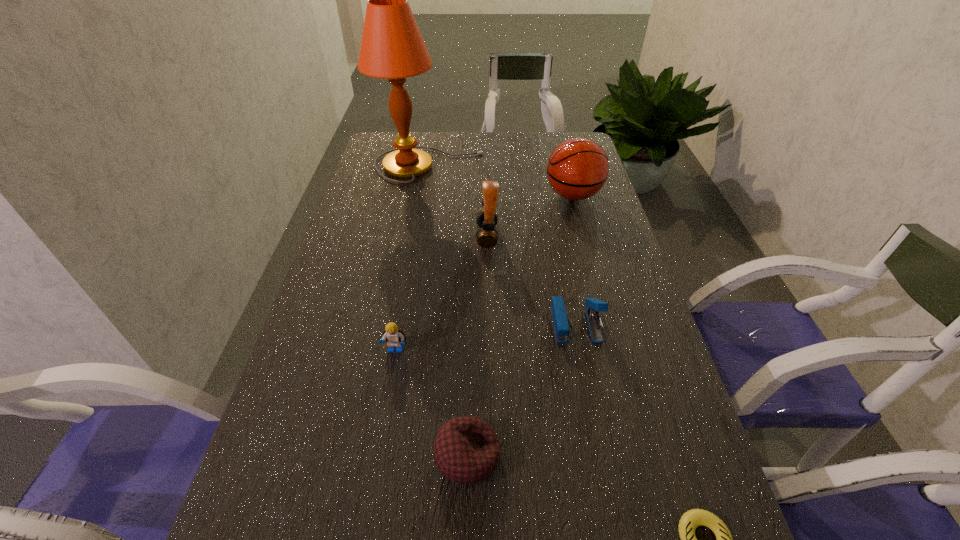
This screenshot has width=960, height=540. Find the location of `vacant region between the basketball and the Lego`. vacant region between the basketball and the Lego is located at coordinates (485, 273).

Identify which object is the nearest to the sixth farthest object. Please provide its 2D coordinates. Your answer should be formatted as a tuple, i.e. [(x, y)], where the tuple contains the x and y coordinates of a point satisfying the conditions above.

[(394, 337)]

The image size is (960, 540). What are the coordinates of `object that is the closest to the nearest object` in the screenshot? It's located at (466, 449).

Identify the location of vacant space that satisfies the following two spatial constraints: 1. on the ear cups of the headset; 2. on the back side of the stapler. The width and height of the screenshot is (960, 540). (489, 323).

Find the location of a particular element. vacant position in the image that satisfies the following two spatial constraints: 1. on the front side of the sixth farthest object; 2. on the left side of the lamp is located at coordinates (383, 456).

At what (x,y) coordinates should I click in order to perform the action: click on free point that satisfies the following two spatial constraints: 1. on the ear cups of the headset; 2. on the front-facing side of the Lego. Please return your answer as a coordinate pair (x, y). The image size is (960, 540). Looking at the image, I should click on (489, 350).